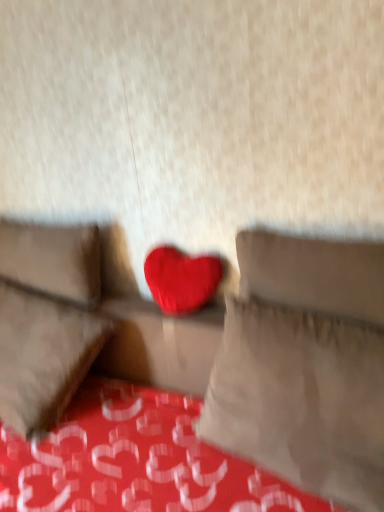
Question: Is matte fabric couch at center to the left or to the right of suede-like beige pillow at left, arranged as the 2th pillow when viewed from the right, in the image?

Choices:
 (A) right
 (B) left

Answer: (A)

Question: Is point (228, 328) closer or farther from the camera than point (39, 237)?

Choices:
 (A) closer
 (B) farther

Answer: (A)

Question: Estimate the real-world distances between objects in this image. Which object is closer to the matte fabric heart at center, which appears as the 1th pillow when viewed from the right?

Choices:
 (A) matte red heart at center
 (B) suede-like beige pillow at left, which appears as the 2th pillow when viewed from the front
 (C) matte fabric couch at center

Answer: (C)

Question: Which object is the closest to the suede-like beige pillow at left, arranged as the 2th pillow when viewed from the right?

Choices:
 (A) matte red heart at center
 (B) matte fabric couch at center
 (C) matte fabric heart at center, placed as the second pillow when sorted from left to right

Answer: (B)